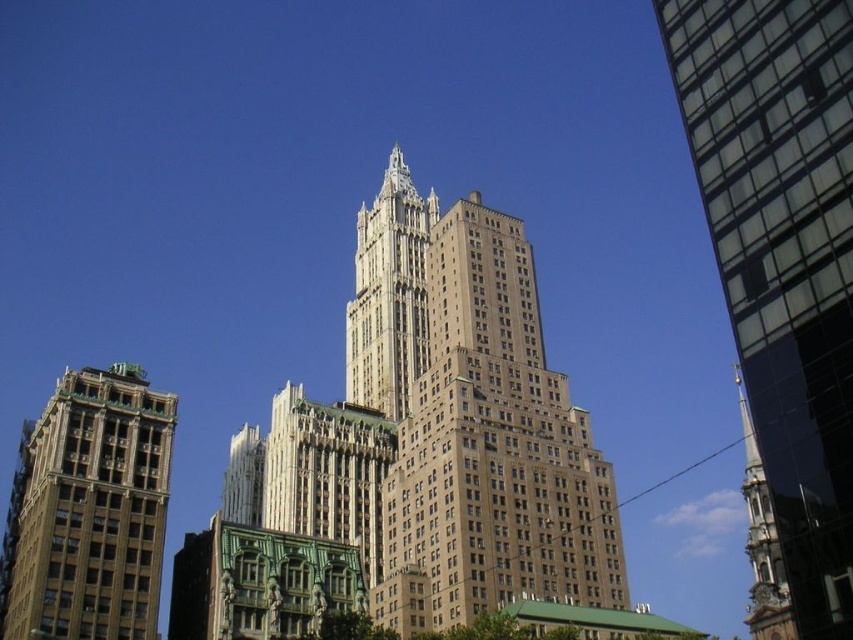
You are standing in the middle of the urban landscape and want to take a photo of both the glassy reflective skyscraper at right and the brown stone tower at left. Which building should you focus on first to ensure both are in frame?

You should focus on the glassy reflective skyscraper at right first because it is closer to you than the brown stone tower at left, so adjusting the camera to include both would require framing starting from the closer one.

You are a tourist standing in front of the gold stone tower at center and want to take a photo of the brown stone tower at left. Which direction should you face to capture both towers in the frame?

You should face towards the left side of the gold stone tower at center to include both the brown stone tower at left and the gold stone tower at center in your photo, since the brown stone tower at left is positioned on the left side of the gold stone tower at center.

You are an architect evaluating the urban skyline. Based on the scene, which of the two structures, the glassy reflective skyscraper at right or the gold stone tower at center, appears to be the more dominant architectural feature in terms of visual prominence?

The gold stone tower at center is the more dominant architectural feature because it is larger in size than the glassy reflective skyscraper at right.